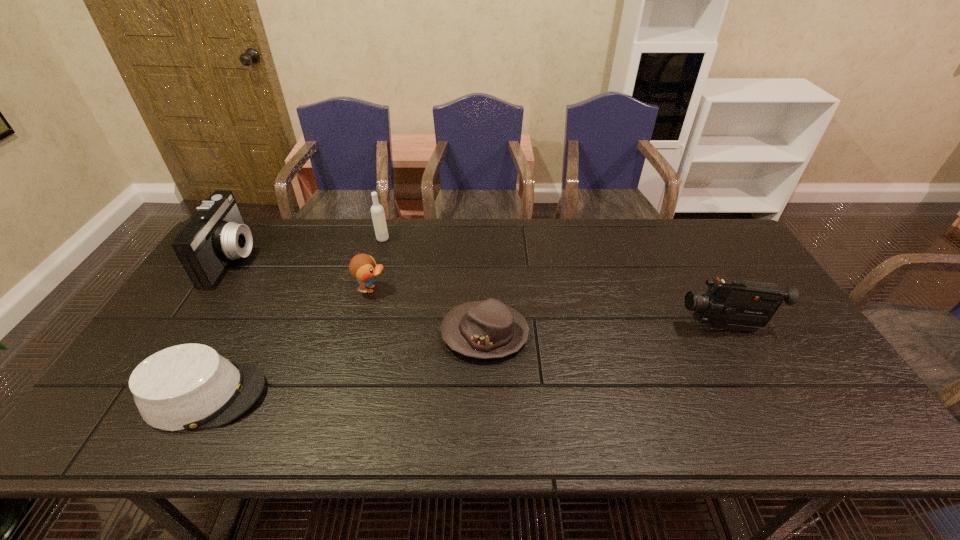
The height and width of the screenshot is (540, 960). I want to click on free spot between the vodka and the left hat, so click(x=294, y=317).

What are the coordinates of `empty space between the vodka and the left hat` in the screenshot? It's located at (294, 317).

The width and height of the screenshot is (960, 540). Identify the location of unoccupied area between the third shortest object and the fifth object from left to right. (428, 312).

You are a GUI agent. You are given a task and a screenshot of the screen. Output one action in this format:
    pyautogui.click(x=<x>, y=<y>)
    Task: Click on the vacant space that is in between the left hat and the fourth tallest object
    This screenshot has height=540, width=960.
    Given the screenshot: What is the action you would take?
    pyautogui.click(x=288, y=342)

I want to click on vacant area that lies between the third shortest object and the rightmost object, so click(x=547, y=308).

I want to click on free space between the left camcorder and the right hat, so click(358, 296).

Locate an element on the screen. vacant area between the vodka and the fourth tallest object is located at coordinates (377, 264).

Find the location of `unoccupied area between the vodka and the third shortest object`. unoccupied area between the vodka and the third shortest object is located at coordinates (377, 264).

This screenshot has width=960, height=540. Find the location of `vacant area that lies between the duck and the left camcorder`. vacant area that lies between the duck and the left camcorder is located at coordinates (301, 274).

Locate an element on the screen. The image size is (960, 540). unoccupied area between the right hat and the vodka is located at coordinates (434, 286).